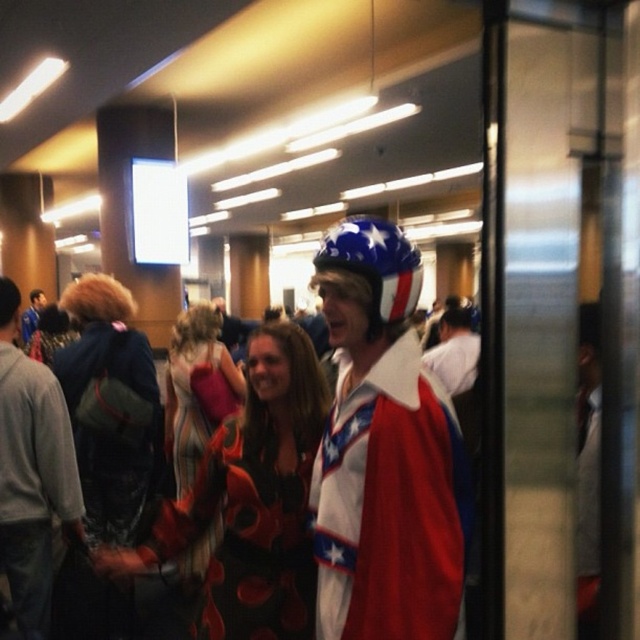
Question: Estimate the real-world distances between objects in this image. Which object is closer to the matte gray sweatshirt at center?

Choices:
 (A) shiny metallic helmet at center
 (B) red and white helmet at center
 (C) american flag painted plastic helmet at center
 (D) matte blue helmet at center

Answer: (A)

Question: Which point is closer to the camera?

Choices:
 (A) striped fabric dress at center
 (B) matte black dress at center

Answer: (B)

Question: Considering the real-world distances, which object is closest to the shiny metallic helmet at center?

Choices:
 (A) matte gray sweatshirt at center
 (B) striped fabric dress at center
 (C) matte blue helmet at center

Answer: (A)

Question: From the image, what is the correct spatial relationship of shiny metallic helmet at center in relation to matte gray sweatshirt at center?

Choices:
 (A) right
 (B) left

Answer: (A)

Question: Is matte gray sweatshirt at center in front of matte blue helmet at center?

Choices:
 (A) yes
 (B) no

Answer: (A)

Question: Is matte black dress at center to the right of striped fabric dress at center from the viewer's perspective?

Choices:
 (A) no
 (B) yes

Answer: (B)